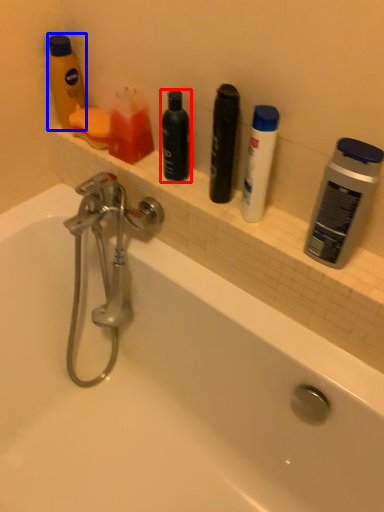
Question: Which object appears closest to the camera in this image, personal care (highlighted by a red box) or toiletry (highlighted by a blue box)?

Choices:
 (A) personal care
 (B) toiletry

Answer: (A)